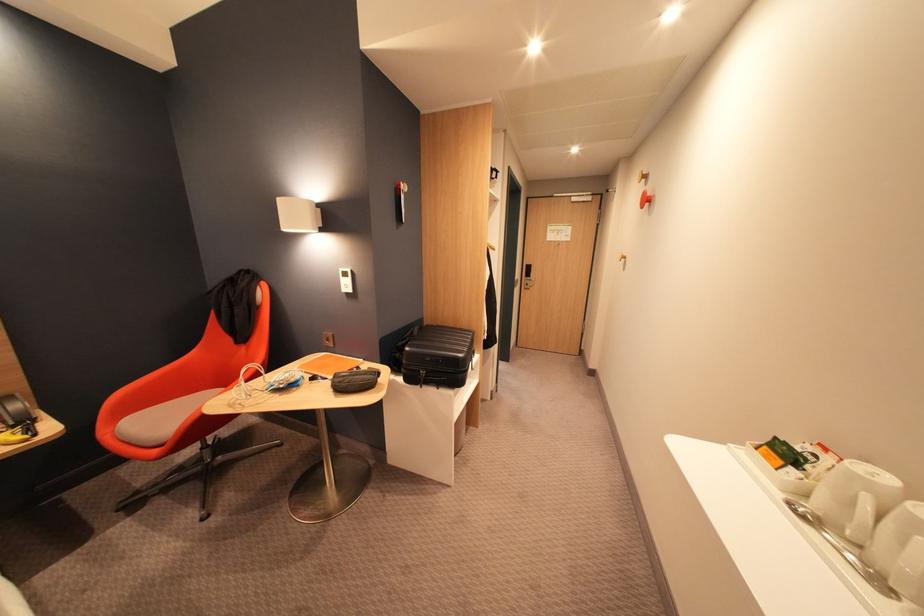
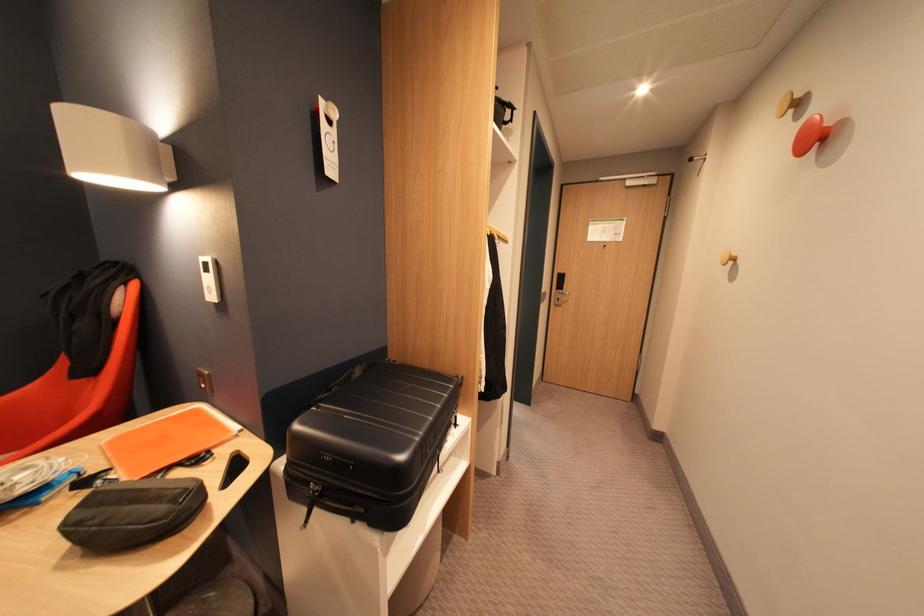
In the second image, find the point that corresponds to the point at 655,185 in the first image.

(809, 118)